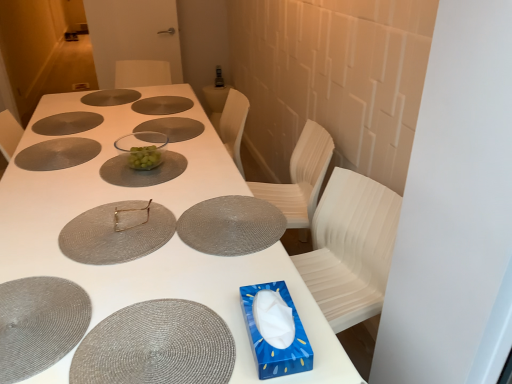
Where is `vacant area situated below matte gray glass plate at upper left, which is the 5th glass plate in back-to-front order (from a real-world perspective)`? vacant area situated below matte gray glass plate at upper left, which is the 5th glass plate in back-to-front order (from a real-world perspective) is located at coordinates (55, 148).